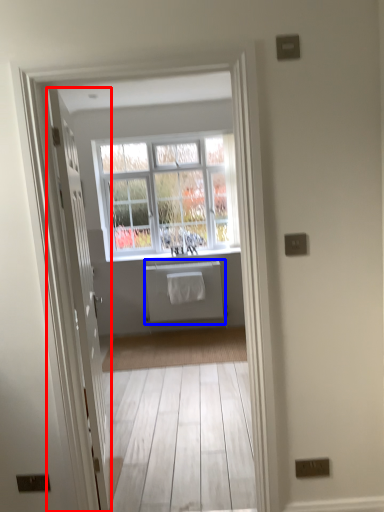
Question: Among these objects, which one is farthest to the camera, door (highlighted by a red box) or appliance (highlighted by a blue box)?

Choices:
 (A) door
 (B) appliance

Answer: (B)